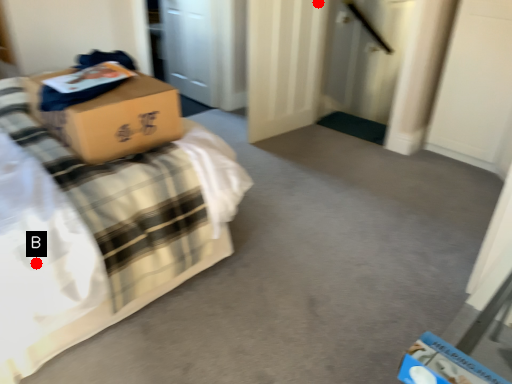
Question: Two points are circled on the image, labeled by A and B beside each circle. Which point is further to the camera?

Choices:
 (A) A is further
 (B) B is further

Answer: (A)